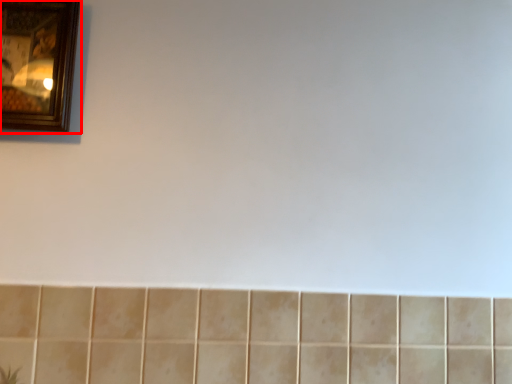
Question: Observing the image, what is the correct spatial positioning of picture frame (annotated by the red box) in reference to ceramic tile?

Choices:
 (A) right
 (B) left

Answer: (B)